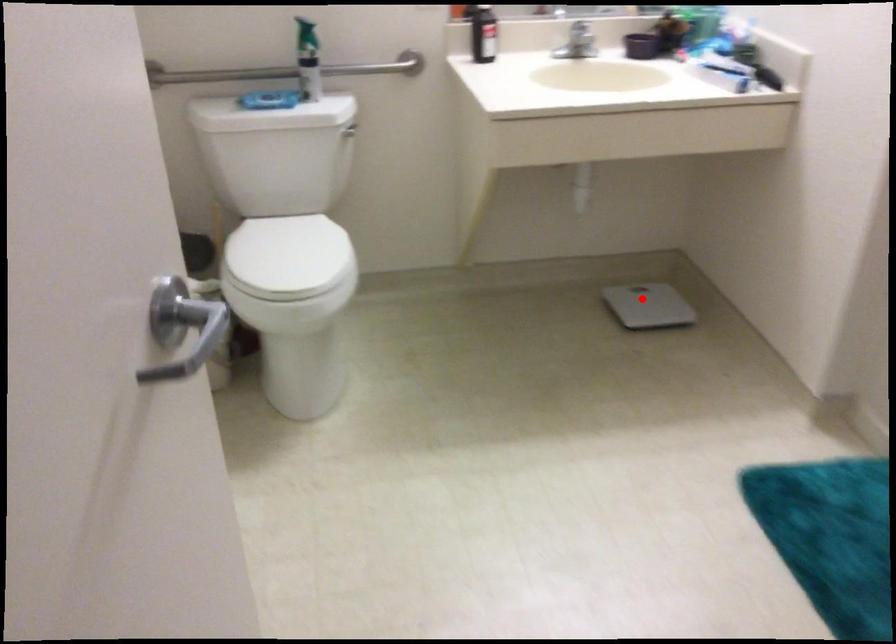
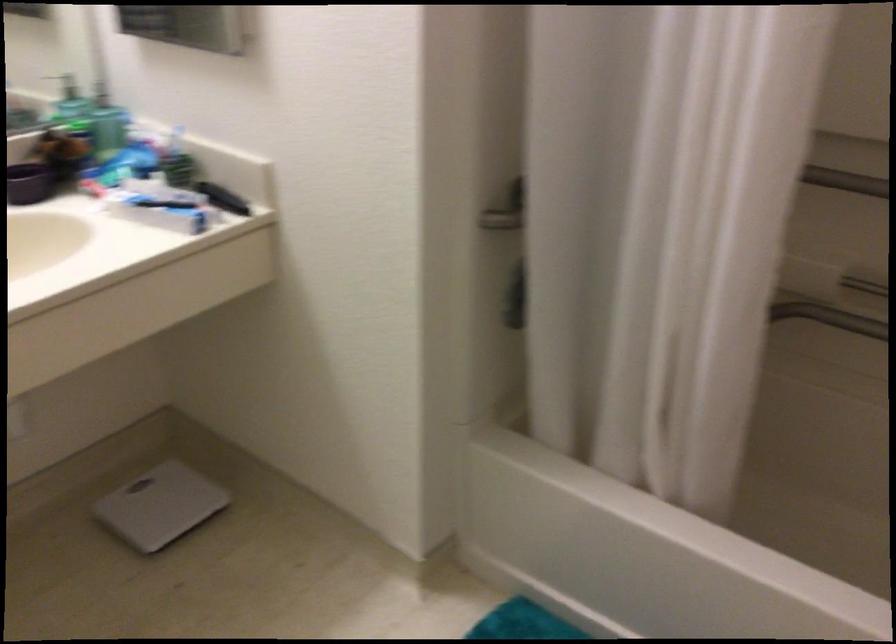
Question: I am providing you with two images of the same scene from different viewpoints. A red point is shown in image1. For the corresponding object point in image2, is it positioned nearer or farther from the camera?

Choices:
 (A) Nearer
 (B) Farther

Answer: (A)